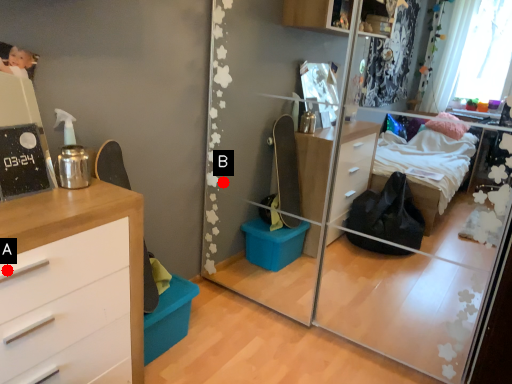
Question: Two points are circled on the image, labeled by A and B beside each circle. Which point is further to the camera?

Choices:
 (A) A is further
 (B) B is further

Answer: (B)